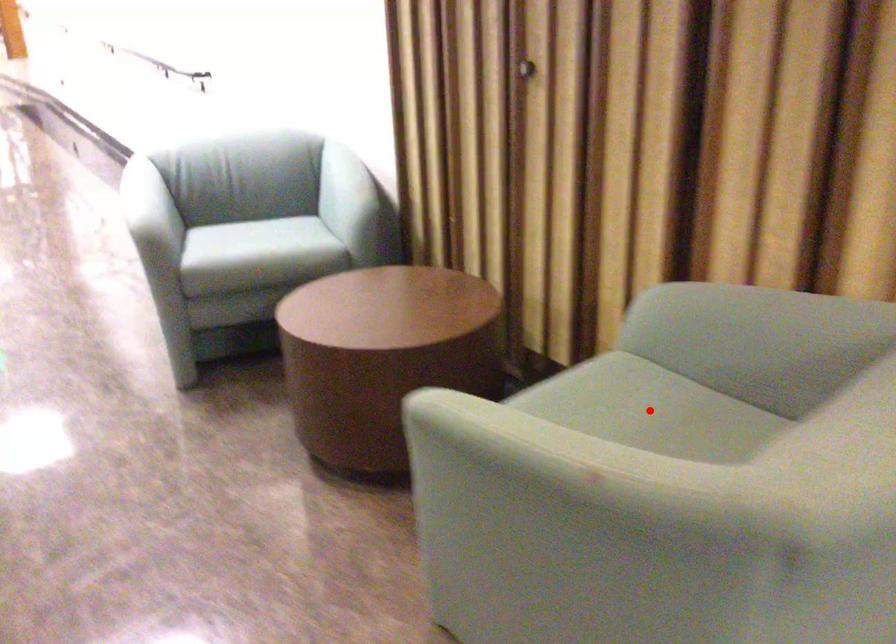
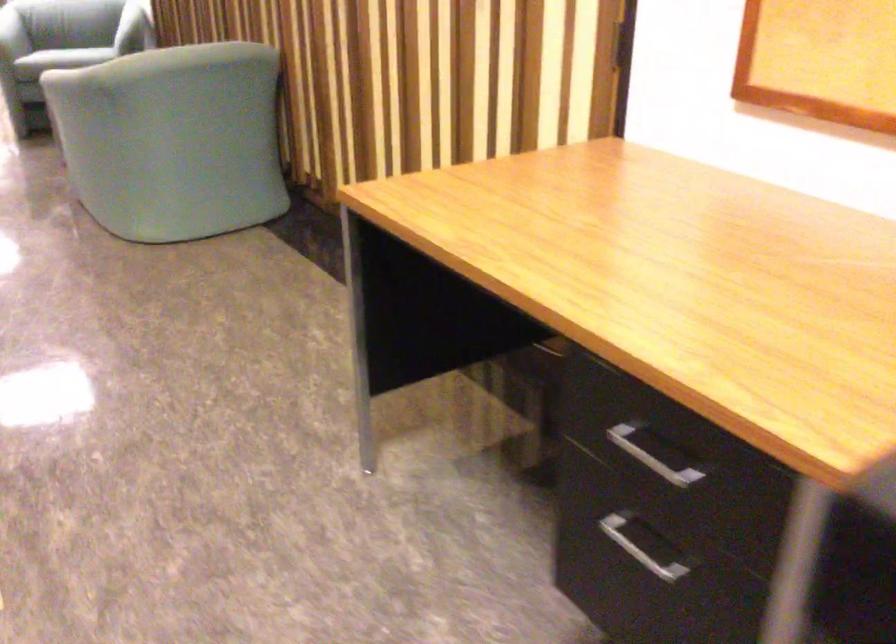
Question: I am providing you with two images of the same scene from different viewpoints. A red point is marked on the first image. At the location where the point appears in image 1, is it still visible in image 2?

Choices:
 (A) Yes
 (B) No

Answer: (B)